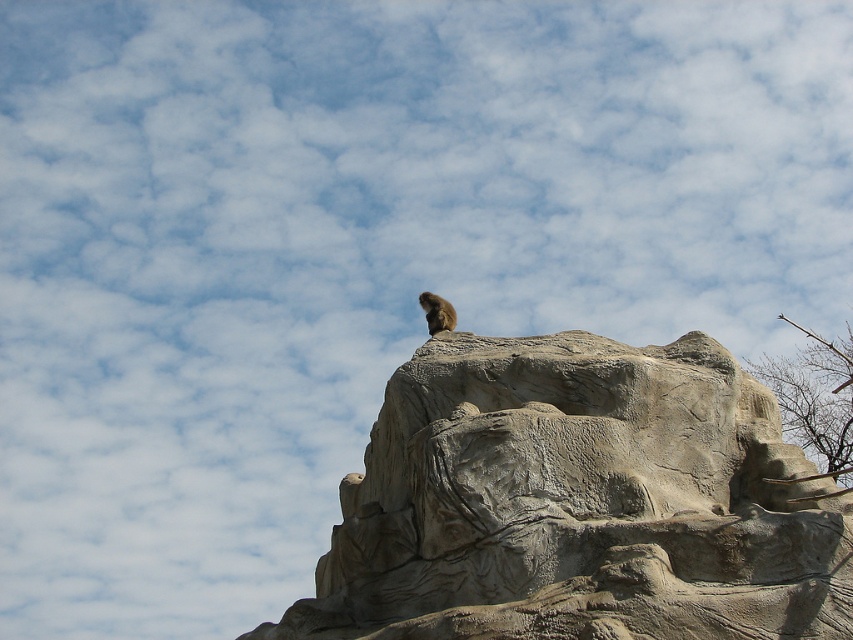
Does gray stone rock at upper center have a greater width compared to brown bark tree at right?

No.

This screenshot has height=640, width=853. What do you see at coordinates (578, 502) in the screenshot? I see `gray stone rock at upper center` at bounding box center [578, 502].

Who is more forward, [608,545] or [827,436]?

Positioned in front is point [608,545].

Where is `gray stone rock at upper center`? This screenshot has height=640, width=853. gray stone rock at upper center is located at coordinates coord(578,502).

Which is more to the left, gray stone rock at upper center or furry brown animal at top?

furry brown animal at top

Find the location of `gray stone rock at upper center`. gray stone rock at upper center is located at coordinates (578, 502).

What do you see at coordinates (815, 397) in the screenshot?
I see `brown bark tree at right` at bounding box center [815, 397].

Does brown bark tree at right have a greater height compared to furry brown animal at top?

Yes, brown bark tree at right is taller than furry brown animal at top.

This screenshot has width=853, height=640. Find the location of `brown bark tree at right`. brown bark tree at right is located at coordinates (815, 397).